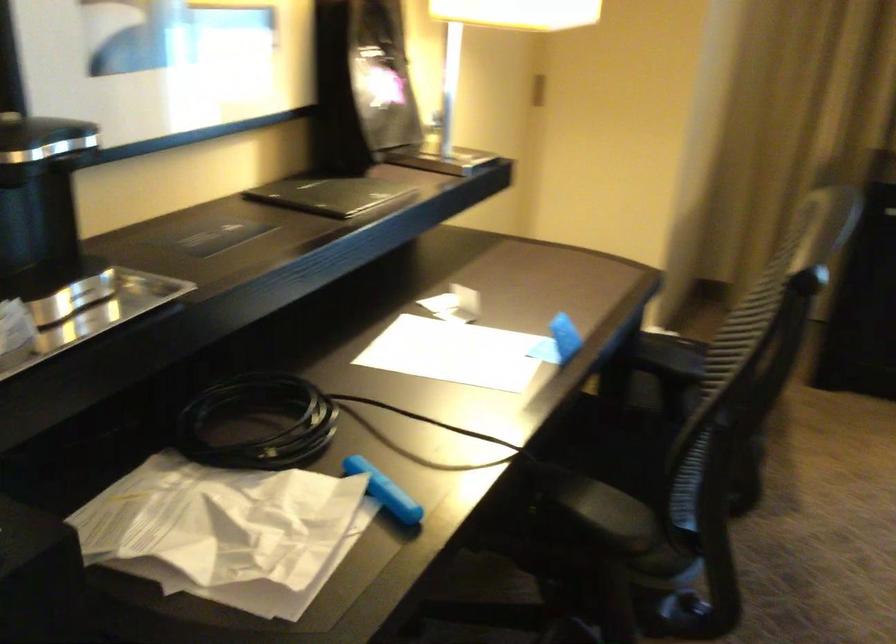
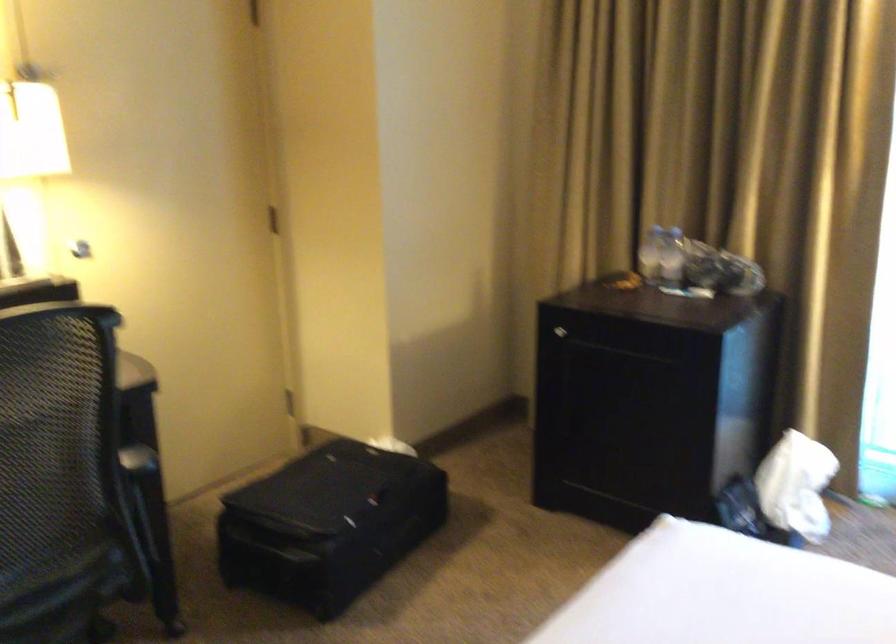
Question: In a continuous first-person perspective shot, in which direction is the camera moving?

Choices:
 (A) Left
 (B) Right
 (C) Forward
 (D) Backward

Answer: (B)